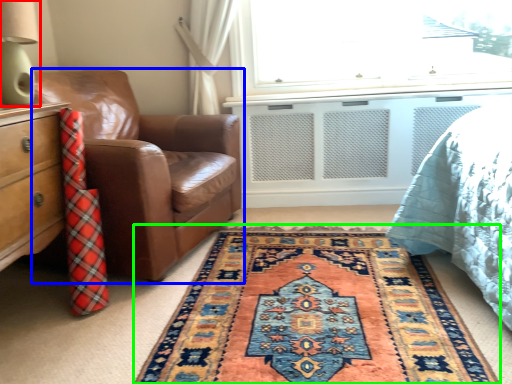
Question: Based on their relative distances, which object is farther from table lamp (highlighted by a red box)? Choose from chair (highlighted by a blue box) and mat (highlighted by a green box).

Choices:
 (A) chair
 (B) mat

Answer: (B)